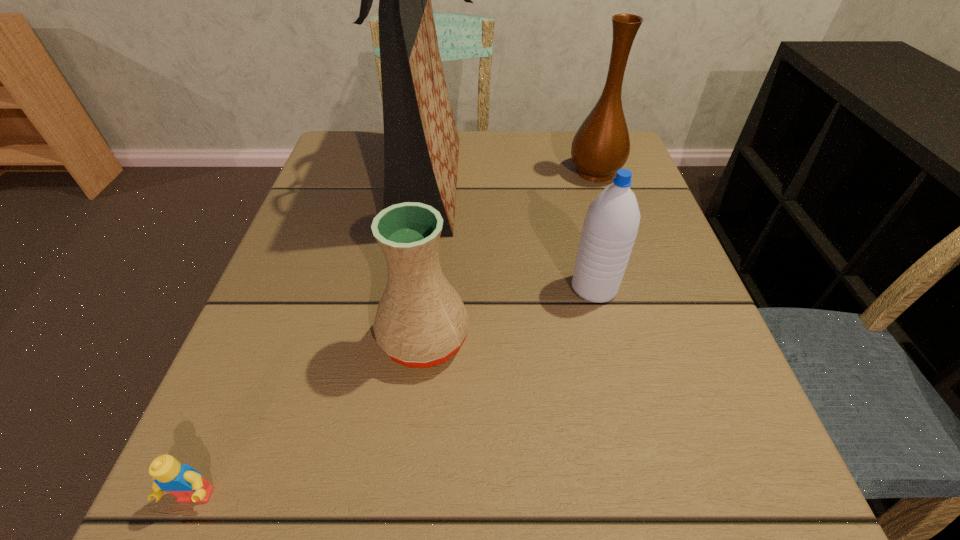
Identify the location of the tallest object. This screenshot has height=540, width=960. (421, 144).

The image size is (960, 540). I want to click on vase, so click(601, 146).

Locate an element on the screen. This screenshot has width=960, height=540. water bottle is located at coordinates (610, 227).

Image resolution: width=960 pixels, height=540 pixels. I want to click on pottery, so click(x=421, y=321).

What are the coordinates of `the shortest object` in the screenshot? It's located at (185, 483).

This screenshot has height=540, width=960. Find the location of `the leftmost object`. the leftmost object is located at coordinates (185, 483).

The image size is (960, 540). In order to click on free space located on the front-facing side of the tallest object in this screenshot , I will do `click(579, 183)`.

Locate an element on the screen. The width and height of the screenshot is (960, 540). vacant space located 0.330m on the left of the fourth shortest object is located at coordinates (423, 172).

Locate an element on the screen. vacant position located 0.170m on the back of the water bottle is located at coordinates (576, 213).

Locate an element on the screen. The image size is (960, 540). free space located 0.300m on the back of the pottery is located at coordinates (440, 197).